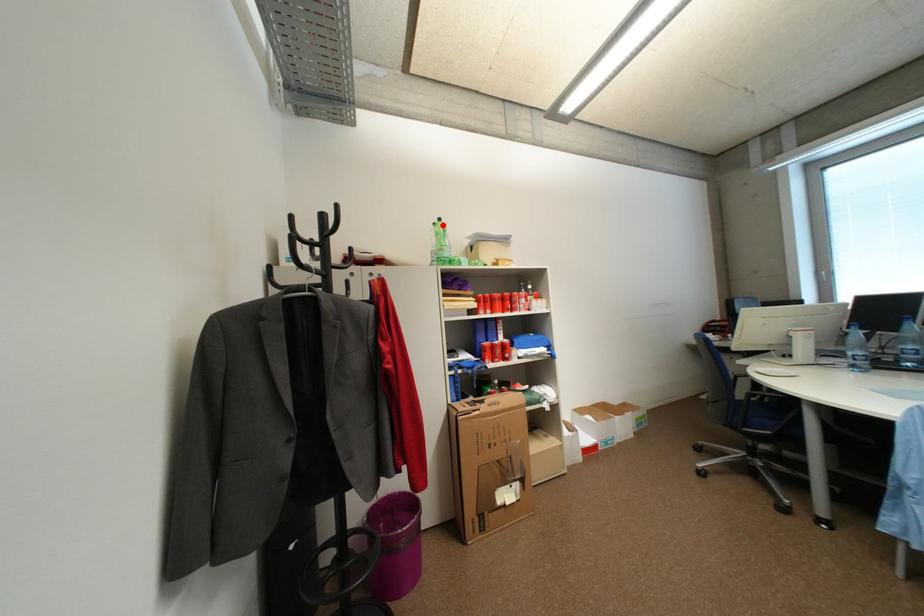
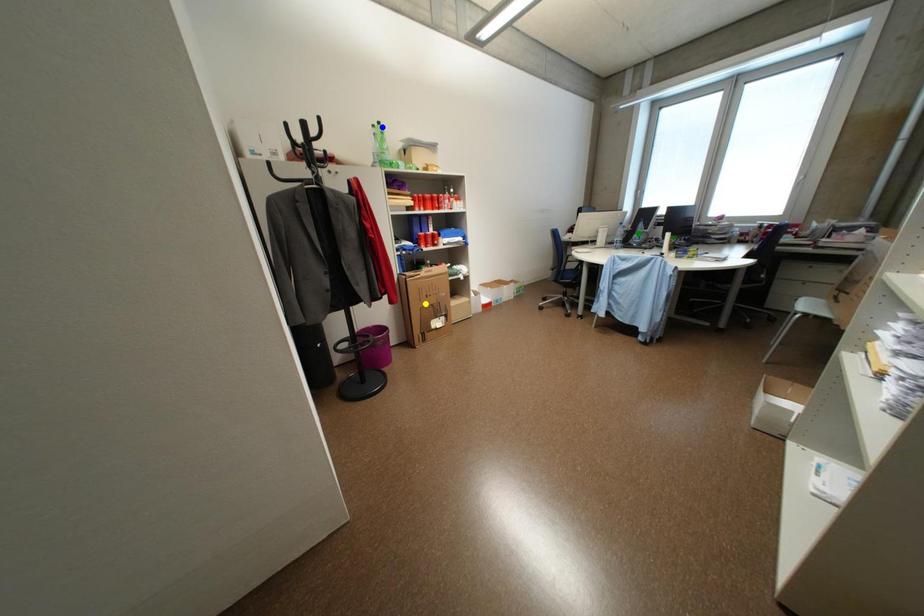
Question: I am providing you with two images of the same scene from different viewpoints. A red point is marked on the first image. You are given multiple points on the second image. Which spot in image 2 lines up with the point in image 1?

Choices:
 (A) blue point
 (B) yellow point
 (C) green point

Answer: (A)